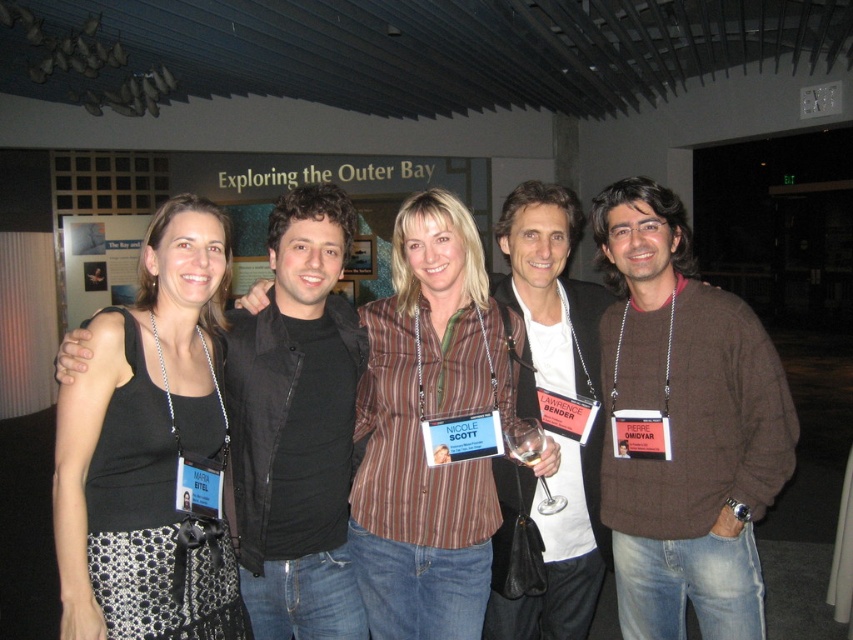
Question: Which object is farther from the camera taking this photo?

Choices:
 (A) brown striped shirt at center
 (B) brown sweater at right

Answer: (B)

Question: Considering the relative positions of black textured tank top at left and brown striped shirt at center in the image provided, where is black textured tank top at left located with respect to brown striped shirt at center?

Choices:
 (A) right
 (B) left

Answer: (B)

Question: Can you confirm if brown sweater at right is positioned to the right of brown striped shirt at center?

Choices:
 (A) yes
 (B) no

Answer: (A)

Question: Among these objects, which one is nearest to the camera?

Choices:
 (A) brown sweater at center
 (B) brown sweater at right
 (C) black textured tank top at left

Answer: (C)

Question: Which object appears farthest from the camera in this image?

Choices:
 (A) brown sweater at center
 (B) brown sweater at right

Answer: (A)

Question: Does black textured tank top at left appear under brown striped shirt at center?

Choices:
 (A) yes
 (B) no

Answer: (B)